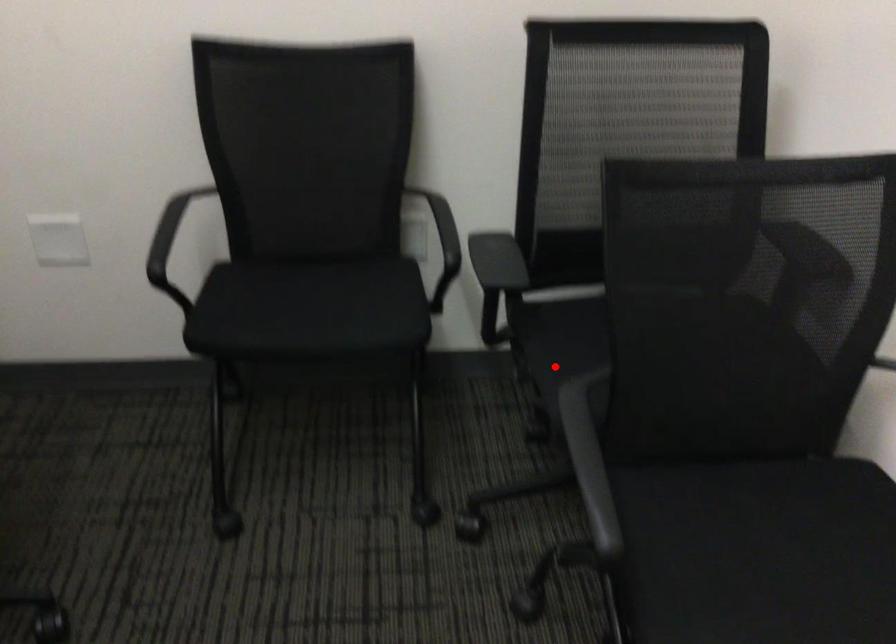
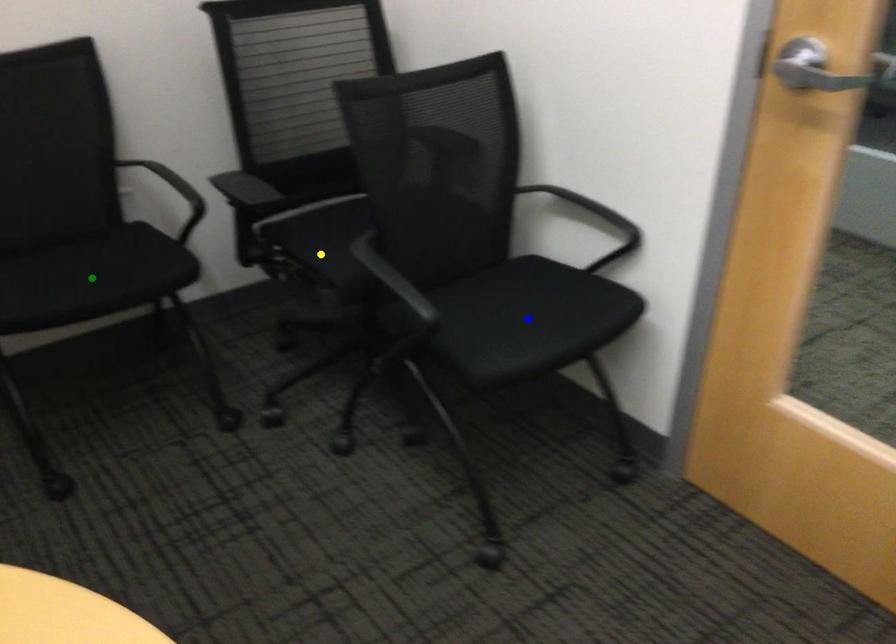
Question: I am providing you with two images of the same scene from different viewpoints. A red point is marked on the first image. You are given multiple points on the second image. Can you choose the point in image 2 that corresponds to the point in image 1?

Choices:
 (A) yellow point
 (B) green point
 (C) blue point

Answer: (A)